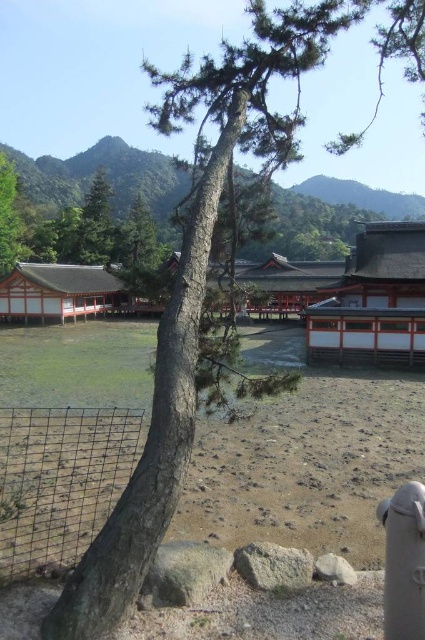
Is point (229, 452) positioned behind point (8, 202)?

No, it is not.

Who is shorter, brown sandy dirt at center or green leafy tree at left?

brown sandy dirt at center is shorter.

Identify the location of brown sandy dirt at center. (308, 467).

Between brown sandy dirt at center and green matte tree at upper center, which one appears on the right side from the viewer's perspective?

Positioned to the right is brown sandy dirt at center.

Does brown sandy dirt at center have a larger size compared to green matte tree at upper center?

Actually, brown sandy dirt at center might be smaller than green matte tree at upper center.

Identify the location of brown sandy dirt at center. Image resolution: width=425 pixels, height=640 pixels. (308, 467).

Which of these two, green matte tree at upper center or green leafy tree at left, stands taller?

green matte tree at upper center

Is green matte tree at upper center taller than green leafy tree at left?

Indeed, green matte tree at upper center has a greater height compared to green leafy tree at left.

Is point (82, 262) positioned after point (11, 211)?

Yes.

You are a GUI agent. You are given a task and a screenshot of the screen. Output one action in this format:
    pyautogui.click(x=<x>, y=<y>)
    Task: Click on the green matte tree at upper center
    
    Given the screenshot: What is the action you would take?
    pyautogui.click(x=95, y=225)